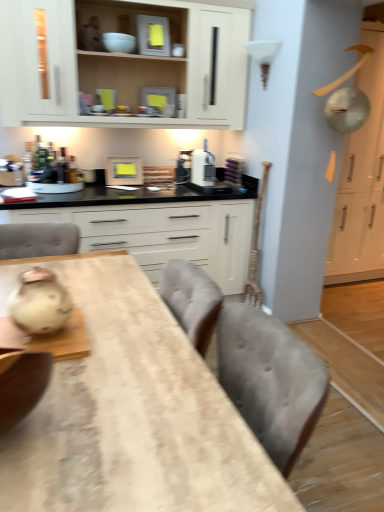
Locate an element on the screen. Image resolution: width=384 pixels, height=512 pixels. white matte cabinet at center, the first cabinetry from the left is located at coordinates (165, 234).

How much space does white matte cabinet at upper center, which appears as the 2th cabinetry when viewed from the left, occupy horizontally?

14.37 inches.

How much space does white matte cabinet at upper center, which appears as the 2th cabinetry when viewed from the left, occupy vertically?

It is 33.24 inches.

The image size is (384, 512). Describe the element at coordinates (132, 414) in the screenshot. I see `wooden table at center` at that location.

Consider the image. Measure the distance between wooden table at center and camera.

wooden table at center is 30.62 inches away from camera.

What do you see at coordinates (362, 181) in the screenshot?
I see `white glossy cabinet at upper right, the third cabinetry in the left-to-right sequence` at bounding box center [362, 181].

The width and height of the screenshot is (384, 512). What do you see at coordinates (153, 35) in the screenshot?
I see `matte gray toaster at upper center, the 1th appliance positioned from the top` at bounding box center [153, 35].

This screenshot has width=384, height=512. I want to click on white matte cabinet at center, acting as the 3th cabinetry starting from the right, so click(x=165, y=234).

Would you consider matte white ceramic tea pot at left to be distant from white matte cabinet at center, the first cabinetry from the left?

Yes, matte white ceramic tea pot at left and white matte cabinet at center, the first cabinetry from the left, are located far from each other.

Considering the positions of points (42, 285) and (129, 234), is point (42, 285) farther from camera compared to point (129, 234)?

No, (42, 285) is closer to viewer.

From the image's perspective, is matte white ceramic tea pot at left below white matte cabinet at center, acting as the 3th cabinetry starting from the right?

Yes, from the image's perspective, matte white ceramic tea pot at left is beneath white matte cabinet at center, acting as the 3th cabinetry starting from the right.

What's the angular difference between white glossy cabinet at upper right, the first cabinetry from the right, and white matte cabinet at upper center, the 2th cabinetry when ordered from right to left,'s facing directions?

The angular difference between white glossy cabinet at upper right, the first cabinetry from the right, and white matte cabinet at upper center, the 2th cabinetry when ordered from right to left, is 0.391 degrees.

Is white glossy cabinet at upper right, the third cabinetry in the left-to-right sequence, bigger or smaller than white matte cabinet at upper center, which appears as the 2th cabinetry when viewed from the left?

In the image, white glossy cabinet at upper right, the third cabinetry in the left-to-right sequence, appears to be larger than white matte cabinet at upper center, which appears as the 2th cabinetry when viewed from the left.

Considering the sizes of white glossy cabinet at upper right, the first cabinetry from the right, and white matte cabinet at upper center, the 2th cabinetry when ordered from right to left, in the image, is white glossy cabinet at upper right, the first cabinetry from the right, wider or thinner than white matte cabinet at upper center, the 2th cabinetry when ordered from right to left,?

white glossy cabinet at upper right, the first cabinetry from the right, is wider than white matte cabinet at upper center, the 2th cabinetry when ordered from right to left.

Is point (359, 189) farther from viewer compared to point (29, 125)?

Yes, it is behind point (29, 125).

Considering the relative sizes of white matte cabinet at upper center, which appears as the 2th cabinetry when viewed from the left, and wooden table at center in the image provided, is white matte cabinet at upper center, which appears as the 2th cabinetry when viewed from the left, thinner than wooden table at center?

Yes.

Does point (11, 63) lie in front of point (63, 283)?

No, (11, 63) is further to viewer.

What's the angular difference between white matte cabinet at upper center, which appears as the 2th cabinetry when viewed from the left, and wooden table at center's facing directions?

88.2 degrees separate the facing orientations of white matte cabinet at upper center, which appears as the 2th cabinetry when viewed from the left, and wooden table at center.

From a real-world perspective, who is located lower, white matte cabinet at upper center, which appears as the 2th cabinetry when viewed from the left, or wooden table at center?

wooden table at center is physically lower.

In the scene shown: Which point is more forward, (239, 213) or (161, 40)?

The point (161, 40) is more forward.

Considering the relative positions of white matte cabinet at center, acting as the 3th cabinetry starting from the right, and matte gray toaster at upper center, positioned as the 1th appliance in front-to-back order, in the image provided, is white matte cabinet at center, acting as the 3th cabinetry starting from the right, to the left of matte gray toaster at upper center, positioned as the 1th appliance in front-to-back order, from the viewer's perspective?

Yes.

From the picture: Is white matte cabinet at center, acting as the 3th cabinetry starting from the right, aimed at matte gray toaster at upper center, positioned as the 1th appliance in front-to-back order?

No.

Based on their positions, is matte white ceramic tea pot at left located to the left or right of white matte cabinet at upper center, which appears as the 2th cabinetry when viewed from the left?

From the image, it's evident that matte white ceramic tea pot at left is to the left of white matte cabinet at upper center, which appears as the 2th cabinetry when viewed from the left.

Is matte white ceramic tea pot at left directly adjacent to white matte cabinet at upper center, the 2th cabinetry when ordered from right to left?

matte white ceramic tea pot at left is not next to white matte cabinet at upper center, the 2th cabinetry when ordered from right to left, and they're not touching.

Between point (71, 310) and point (30, 83), which one is positioned behind?

Positioned behind is point (30, 83).

How much distance is there between matte white ceramic tea pot at left and white matte cabinet at upper center, the 2th cabinetry when ordered from right to left?

The distance of matte white ceramic tea pot at left from white matte cabinet at upper center, the 2th cabinetry when ordered from right to left, is 1.78 meters.

Is white matte cabinet at center, the first cabinetry from the left, wider or thinner than wooden frame at upper center, which is the third appliance in top-to-bottom order?

Considering their sizes, white matte cabinet at center, the first cabinetry from the left, looks broader than wooden frame at upper center, which is the third appliance in top-to-bottom order.

From the image's perspective, which appliance is the 1st one above the white matte cabinet at center, the first cabinetry from the left? Please provide its 2D coordinates.

[(124, 170)]

Is point (222, 265) closer to viewer compared to point (139, 170)?

That is True.

How many degrees apart are the facing directions of wooden table at center and white matte cabinet at upper center, which appears as the 2th cabinetry when viewed from the left?

The facing directions of wooden table at center and white matte cabinet at upper center, which appears as the 2th cabinetry when viewed from the left, are 88.2 degrees apart.

In terms of height, does wooden table at center look taller or shorter compared to white matte cabinet at upper center, the 2th cabinetry when ordered from right to left?

wooden table at center is shorter than white matte cabinet at upper center, the 2th cabinetry when ordered from right to left.

From the image's perspective, which one is positioned lower, wooden table at center or white matte cabinet at upper center, the 2th cabinetry when ordered from right to left?

wooden table at center appears lower in the image.

Is the depth of wooden table at center less than that of white matte cabinet at upper center, which appears as the 2th cabinetry when viewed from the left?

A: Yes, it is.

Where is `tea pot located below the white matte cabinet at center, the first cabinetry from the left (from the image's perspective)`? tea pot located below the white matte cabinet at center, the first cabinetry from the left (from the image's perspective) is located at coordinates (x=39, y=302).

From the white matte cabinet at upper center, the 2th cabinetry when ordered from right to left, count 2nd cabinetrys backward and point to it. Please provide its 2D coordinates.

[(362, 181)]

Estimate the real-world distances between objects in this image. Which object is closer to white matte cabinet at upper center, which appears as the 2th cabinetry when viewed from the left, wooden frame at upper center, positioned as the 1th appliance in bottom-to-top order, or matte gray toaster at upper center, the 1th appliance positioned from the top?

matte gray toaster at upper center, the 1th appliance positioned from the top.

Which object lies nearer to the anchor point white glossy cabinet at upper right, the first cabinetry from the right, wooden table at center or white matte cabinet at upper center, which appears as the 2th cabinetry when viewed from the left?

The object closer to white glossy cabinet at upper right, the first cabinetry from the right, is white matte cabinet at upper center, which appears as the 2th cabinetry when viewed from the left.

When comparing their distances from metallic silver toaster at upper center, which ranks as the second appliance in front-to-back order, does white glossy cabinet at upper right, the third cabinetry in the left-to-right sequence, or matte white ceramic tea pot at left seem closer?

white glossy cabinet at upper right, the third cabinetry in the left-to-right sequence, is closer to metallic silver toaster at upper center, which ranks as the second appliance in front-to-back order.

Which object lies further to the anchor point white matte cabinet at center, the first cabinetry from the left, matte white ceramic tea pot at left or white matte cabinet at upper center, the 2th cabinetry when ordered from right to left?

Based on the image, matte white ceramic tea pot at left appears to be further to white matte cabinet at center, the first cabinetry from the left.

When comparing their distances from wooden frame at upper center, positioned as the 1th appliance in bottom-to-top order, does white matte cabinet at upper center, which appears as the 2th cabinetry when viewed from the left, or wooden table at center seem closer?

white matte cabinet at upper center, which appears as the 2th cabinetry when viewed from the left.

Estimate the real-world distances between objects in this image. Which object is closer to matte gray toaster at upper center, the 1th appliance positioned from the top, wooden table at center or white matte cabinet at upper center, the 2th cabinetry when ordered from right to left?

white matte cabinet at upper center, the 2th cabinetry when ordered from right to left.

From the image, which object appears to be farther from white glossy cabinet at upper right, the first cabinetry from the right, matte gray toaster at upper center, acting as the 3th appliance starting from the bottom, or metallic silver toaster at upper center, the second appliance in the bottom-to-top sequence?

matte gray toaster at upper center, acting as the 3th appliance starting from the bottom, lies further to white glossy cabinet at upper right, the first cabinetry from the right, than the other object.

Which object lies further to the anchor point matte white ceramic tea pot at left, matte gray toaster at upper center, the 1th appliance positioned from the top, or white glossy cabinet at upper right, the first cabinetry from the right?

white glossy cabinet at upper right, the first cabinetry from the right.

This screenshot has height=512, width=384. What are the coordinates of `appliance between metallic silver toaster at upper center, which ranks as the second appliance in top-to-bottom order, and white matte cabinet at center, the first cabinetry from the left, in the up-down direction` in the screenshot? It's located at (124, 170).

Where is `cabinetry between wooden table at center and white matte cabinet at center, acting as the 3th cabinetry starting from the right, from front to back`? This screenshot has width=384, height=512. cabinetry between wooden table at center and white matte cabinet at center, acting as the 3th cabinetry starting from the right, from front to back is located at coordinates (121, 62).

The height and width of the screenshot is (512, 384). In order to click on appliance located between matte white ceramic tea pot at left and metallic silver toaster at upper center, which ranks as the second appliance in front-to-back order, in the depth direction in this screenshot , I will do `click(153, 35)`.

Where is `appliance that lies between matte gray toaster at upper center, positioned as the 1th appliance in front-to-back order, and wooden frame at upper center, positioned as the 1th appliance in bottom-to-top order, from top to bottom`? appliance that lies between matte gray toaster at upper center, positioned as the 1th appliance in front-to-back order, and wooden frame at upper center, positioned as the 1th appliance in bottom-to-top order, from top to bottom is located at coordinates (159, 101).